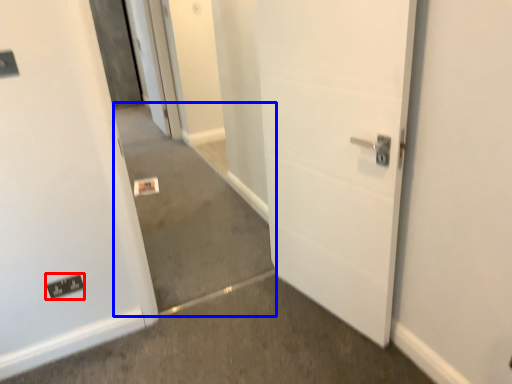
Question: Which of the following is the farthest to the observer, electric outlet (highlighted by a red box) or concrete (highlighted by a blue box)?

Choices:
 (A) electric outlet
 (B) concrete

Answer: (A)